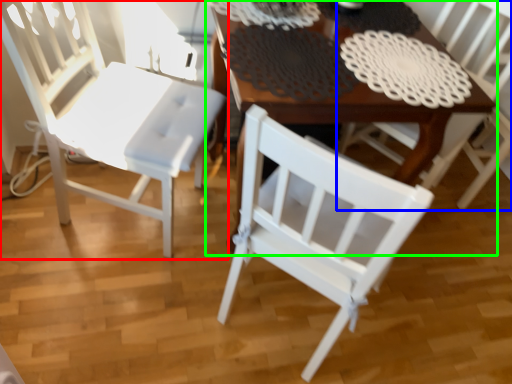
Question: Based on their relative distances, which object is farther from chair (highlighted by a red box)? Choose from chair (highlighted by a blue box) and table (highlighted by a green box).

Choices:
 (A) chair
 (B) table

Answer: (A)